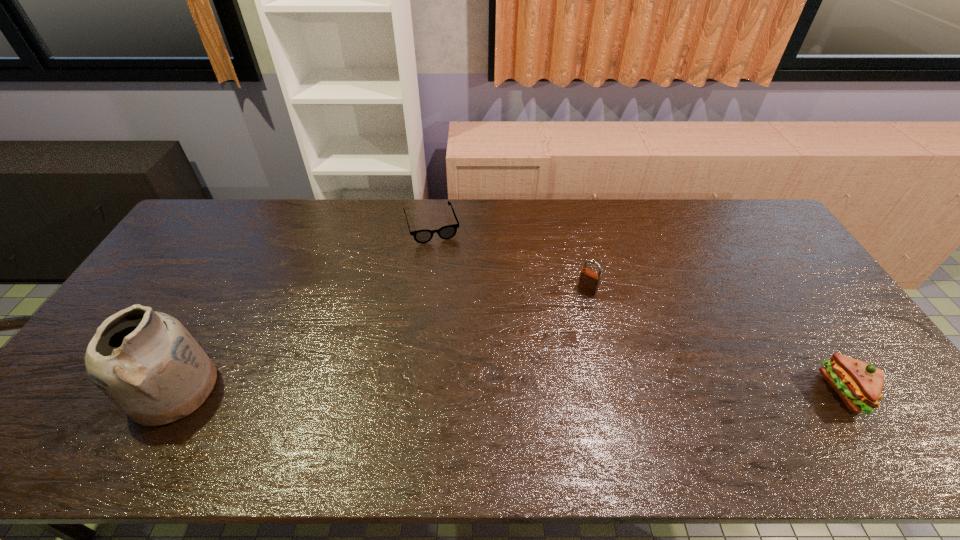
This screenshot has width=960, height=540. I want to click on the leftmost object, so click(x=147, y=363).

What are the coordinates of `pottery` in the screenshot? It's located at (147, 363).

At what (x,y) coordinates should I click in order to perform the action: click on sandwich. Please return your answer as a coordinate pair (x, y). This screenshot has height=540, width=960. Looking at the image, I should click on (859, 384).

Image resolution: width=960 pixels, height=540 pixels. Identify the location of spectacles. (446, 232).

Locate an element on the screen. The image size is (960, 540). the third object from right to left is located at coordinates (446, 232).

Identify the location of the second object from right to left. This screenshot has width=960, height=540. click(589, 281).

The height and width of the screenshot is (540, 960). I want to click on padlock, so click(589, 281).

The image size is (960, 540). What are the coordinates of `free space located on the left of the tallest object` in the screenshot? It's located at (77, 389).

This screenshot has width=960, height=540. In order to click on vacant point located 0.220m on the left of the sandwich in this screenshot , I will do `click(738, 392)`.

In order to click on free space located 0.150m on the arms of the farthest object in this screenshot , I will do `click(446, 275)`.